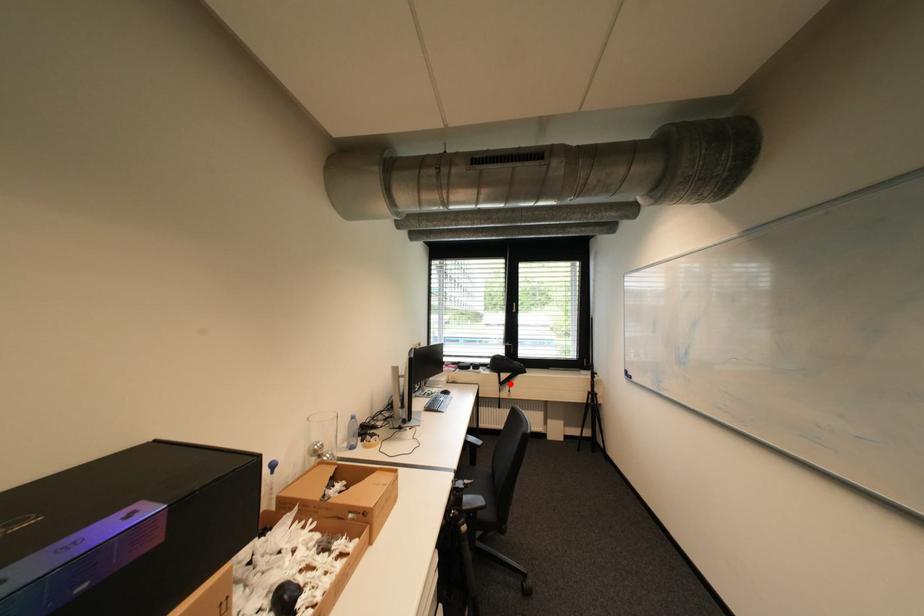
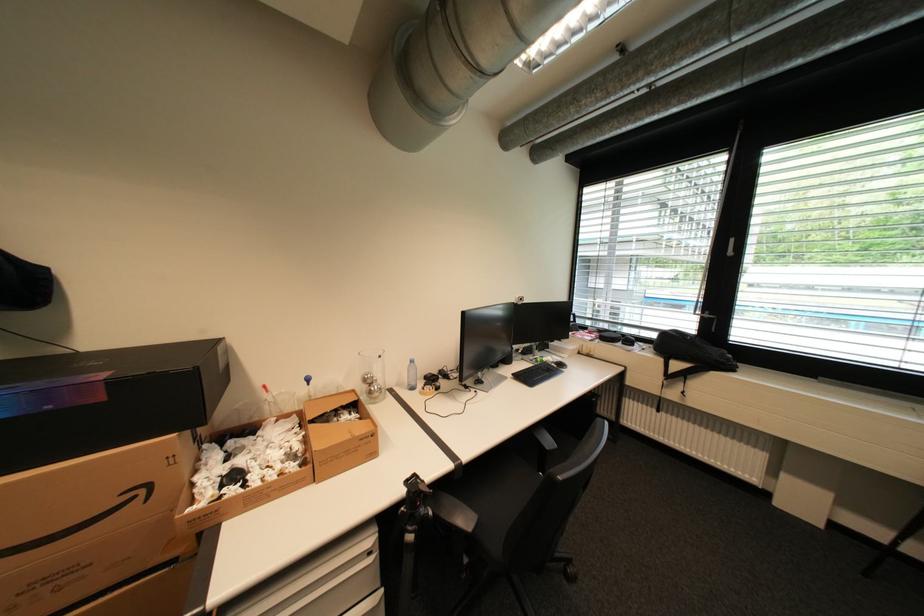
Where in the second image is the point corresponding to the highlighted location from the first image?

(678, 377)